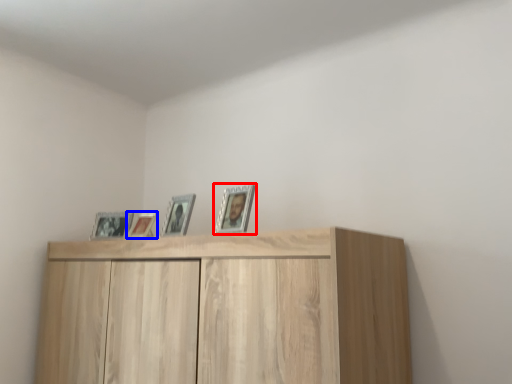
Question: Which object is further to the camera taking this photo, picture frame (highlighted by a red box) or picture frame (highlighted by a blue box)?

Choices:
 (A) picture frame
 (B) picture frame

Answer: (B)